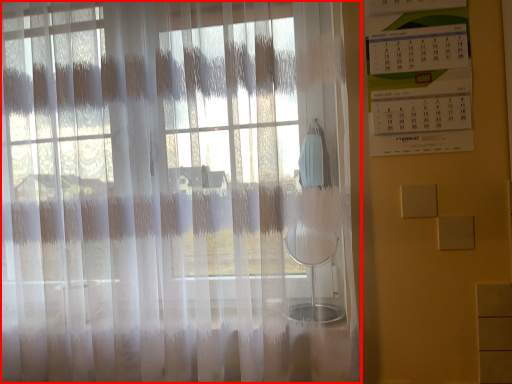
Question: Observing the image, what is the correct spatial positioning of curtain (annotated by the red box) in reference to bulletin board?

Choices:
 (A) left
 (B) right

Answer: (A)